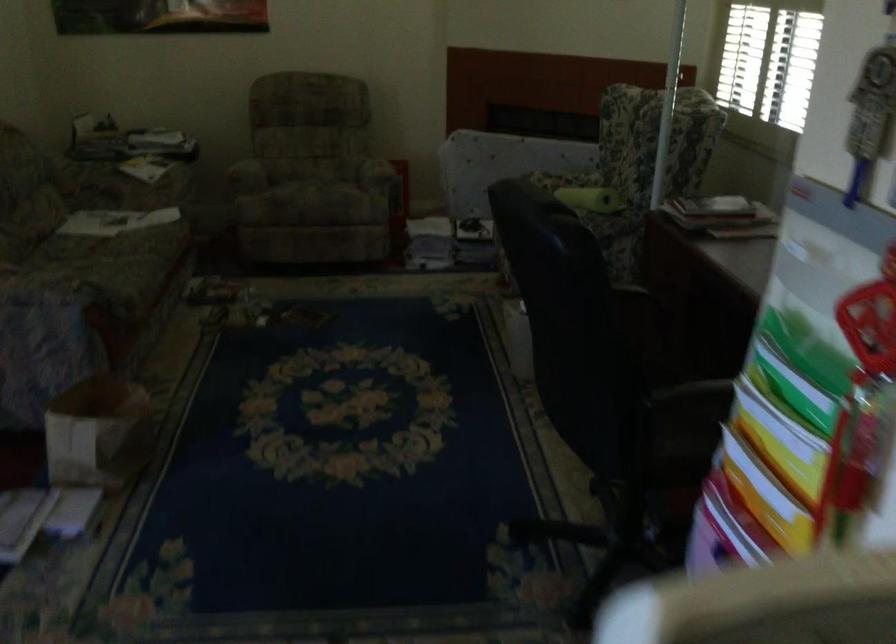
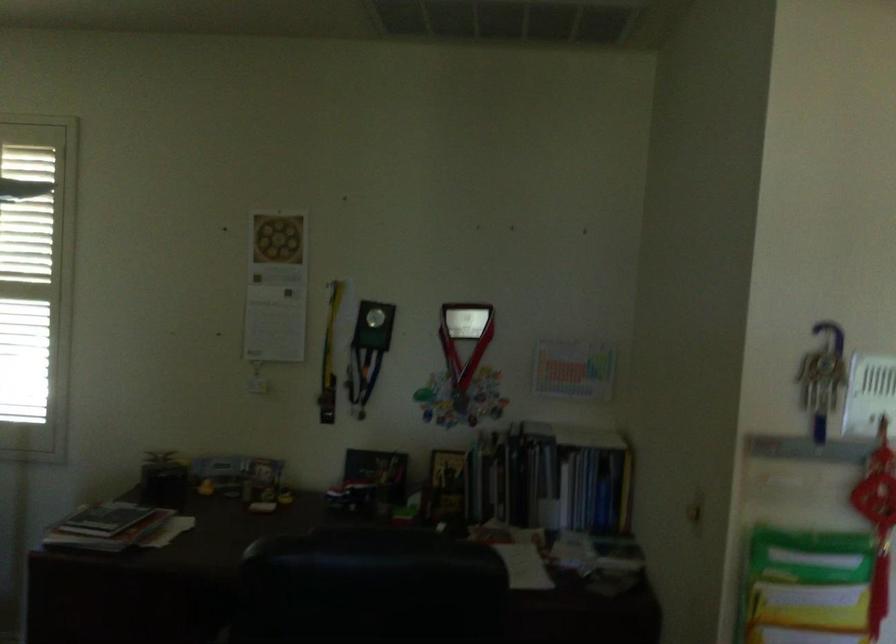
Locate, in the second image, the point that corresponds to pixel 698 204 in the first image.

(104, 518)